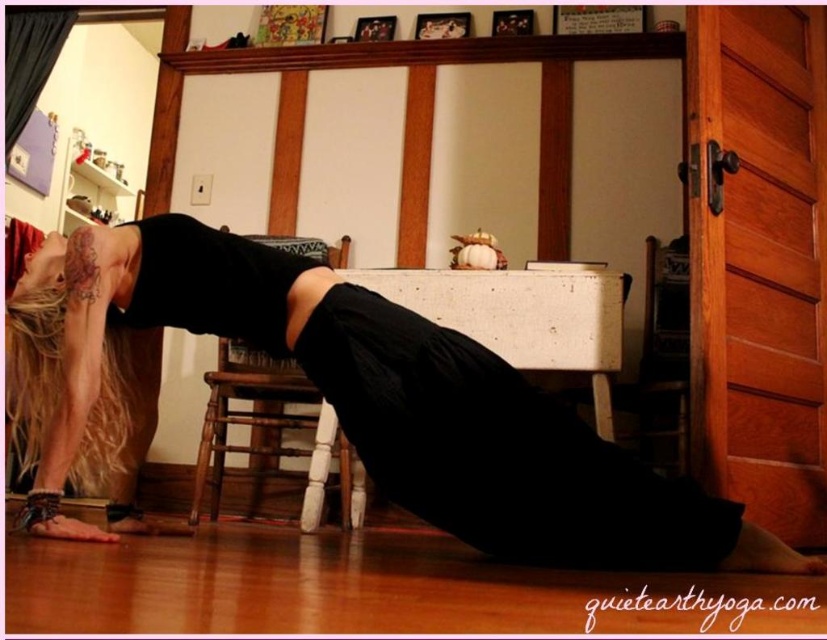
Question: Is black matte yoga mat at lower center to the right of black matte dress at lower center from the viewer's perspective?

Choices:
 (A) yes
 (B) no

Answer: (B)

Question: Which of the following is the farthest from the observer?

Choices:
 (A) black matte dress at lower center
 (B) black matte yoga mat at lower center
 (C) white wood stool at center

Answer: (C)

Question: Is black matte yoga mat at lower center wider than black matte dress at lower center?

Choices:
 (A) yes
 (B) no

Answer: (A)

Question: Can you confirm if black matte yoga mat at lower center is positioned to the left of black matte dress at lower center?

Choices:
 (A) no
 (B) yes

Answer: (B)

Question: Which of these objects is positioned farthest from the white wood stool at center?

Choices:
 (A) black matte yoga mat at lower center
 (B) black matte dress at lower center

Answer: (B)

Question: Among these points, which one is nearest to the camera?

Choices:
 (A) (328, 460)
 (B) (438, 400)

Answer: (B)